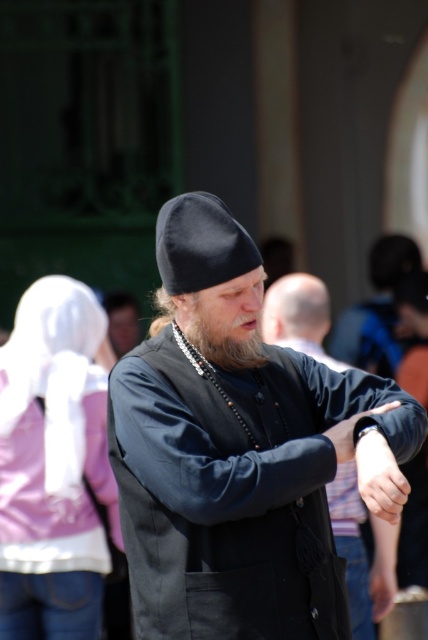
Is black matte robe at center wider than grayish-black beard at center?

Indeed, black matte robe at center has a greater width compared to grayish-black beard at center.

Between point (312, 492) and point (250, 339), which one is positioned behind?

Positioned behind is point (250, 339).

Which is behind, point (145, 394) or point (225, 349)?

The point (225, 349) is more distant.

This screenshot has height=640, width=428. What are the coordinates of `black matte robe at center` in the screenshot? It's located at (237, 488).

Is dark blue fabric coat at center wider than smooth skin hand at center?

Indeed, dark blue fabric coat at center has a greater width compared to smooth skin hand at center.

Does point (386, 528) lie behind point (377, 620)?

That is False.

Is point (354, 572) less distant than point (382, 572)?

Yes.

Locate an element on the screen. dark blue fabric coat at center is located at coordinates (299, 316).

What do you see at coordinates (237, 488) in the screenshot? The height and width of the screenshot is (640, 428). I see `black matte robe at center` at bounding box center [237, 488].

Between point (130, 371) and point (386, 570), which one is positioned in front?

Positioned in front is point (130, 371).

This screenshot has height=640, width=428. I want to click on black matte robe at center, so click(237, 488).